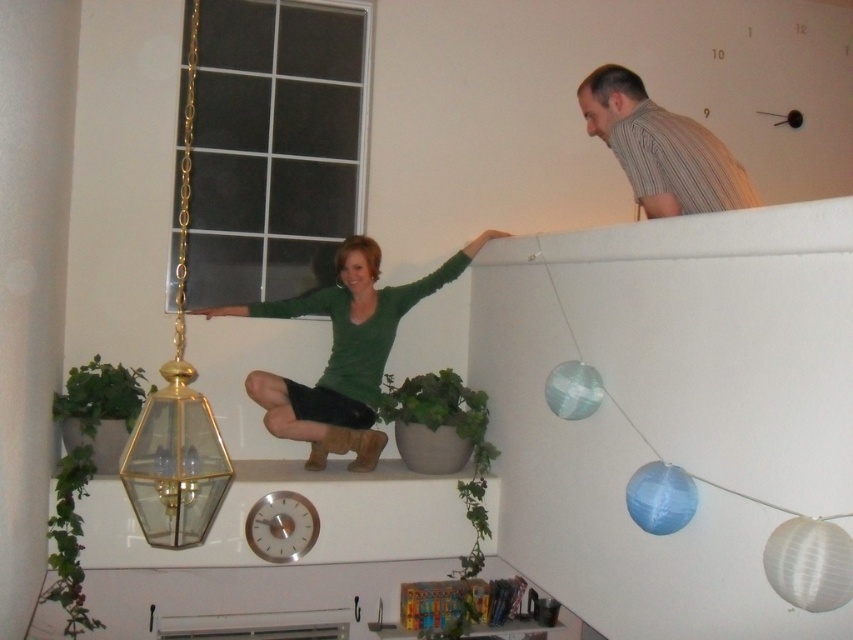
Can you confirm if green matte sweater at upper center is taller than gold glass pendant light at upper left?

In fact, green matte sweater at upper center may be shorter than gold glass pendant light at upper left.

Between green matte sweater at upper center and gold glass pendant light at upper left, which one appears on the left side from the viewer's perspective?

gold glass pendant light at upper left

Describe the element at coordinates (343, 353) in the screenshot. I see `green matte sweater at upper center` at that location.

Where is `green matte sweater at upper center`? This screenshot has height=640, width=853. green matte sweater at upper center is located at coordinates (343, 353).

Which is more to the right, gold glass pendant light at upper left or striped cotton shirt at upper right?

From the viewer's perspective, striped cotton shirt at upper right appears more on the right side.

Does gold glass pendant light at upper left appear over striped cotton shirt at upper right?

Correct, gold glass pendant light at upper left is located above striped cotton shirt at upper right.

Between point (175, 355) and point (677, 189), which one is positioned in front?

Positioned in front is point (677, 189).

This screenshot has width=853, height=640. I want to click on gold glass pendant light at upper left, so click(x=177, y=406).

Does green matte sweater at upper center appear on the left side of striped cotton shirt at upper right?

Yes, green matte sweater at upper center is to the left of striped cotton shirt at upper right.

Measure the distance between green matte sweater at upper center and striped cotton shirt at upper right.

The distance of green matte sweater at upper center from striped cotton shirt at upper right is 4.35 feet.

What do you see at coordinates (343, 353) in the screenshot? I see `green matte sweater at upper center` at bounding box center [343, 353].

Locate an element on the screen. The width and height of the screenshot is (853, 640). green matte sweater at upper center is located at coordinates [343, 353].